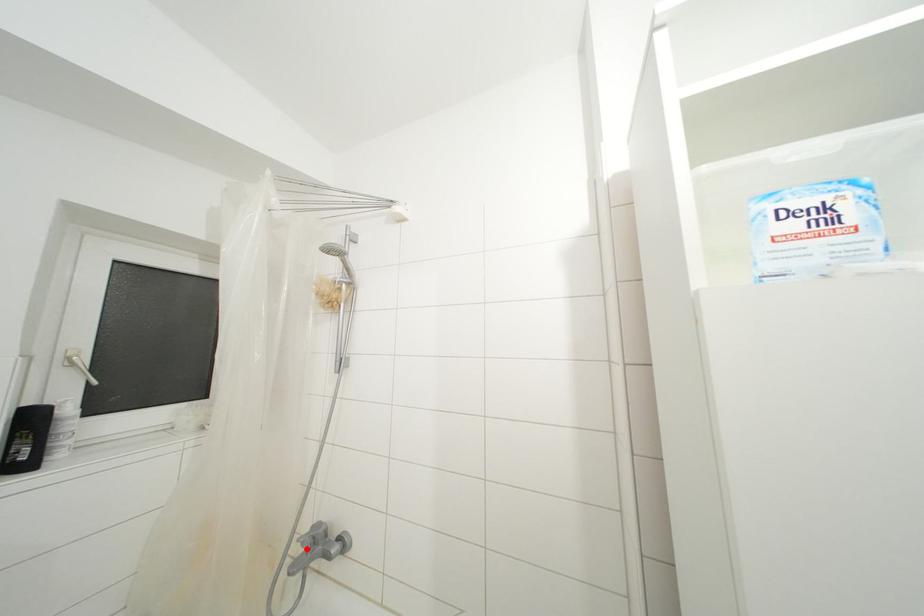
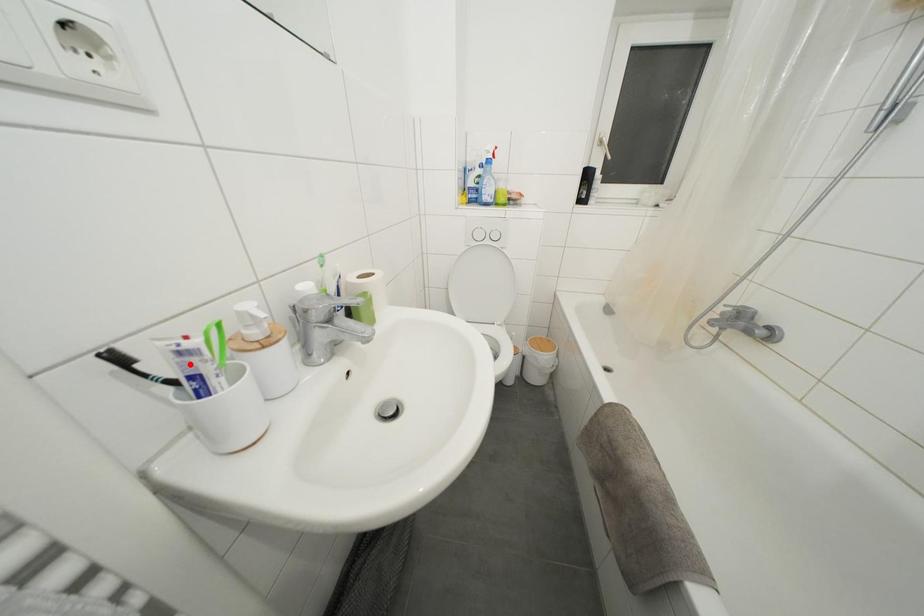
I am providing you with two images of the same scene from different viewpoints. A red point is marked on the first image and another point is marked on the second image. Is the red point in image1 aligned with the point shown in image2?

No